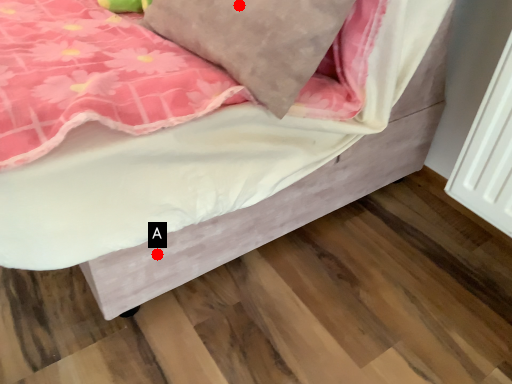
Question: Two points are circled on the image, labeled by A and B beside each circle. Which point appears farthest from the camera in this image?

Choices:
 (A) A is further
 (B) B is further

Answer: (A)